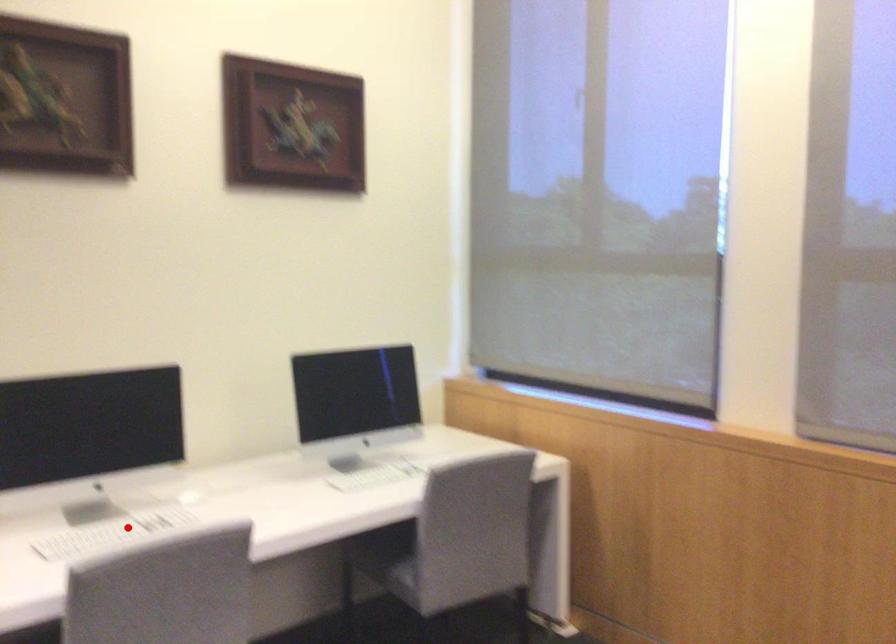
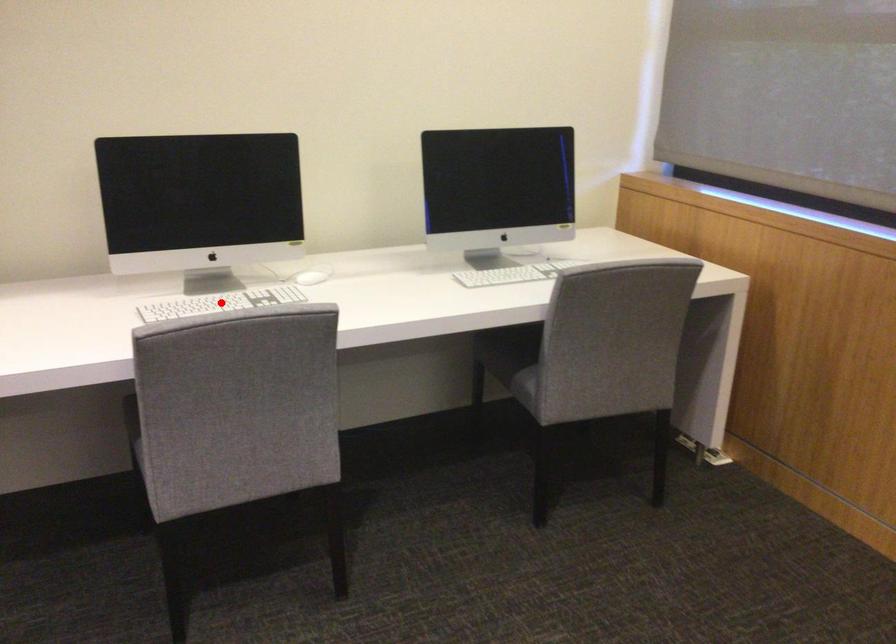
I am providing you with two images of the same scene from different viewpoints. A red point is marked on the first image and another point is marked on the second image. Are the points marked in image1 and image2 representing the same 3D position?

Yes